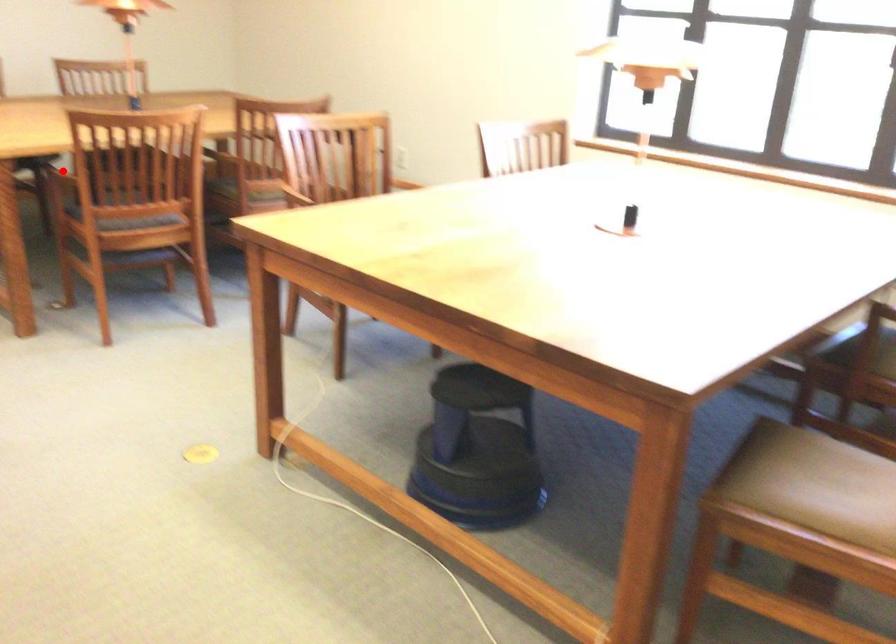
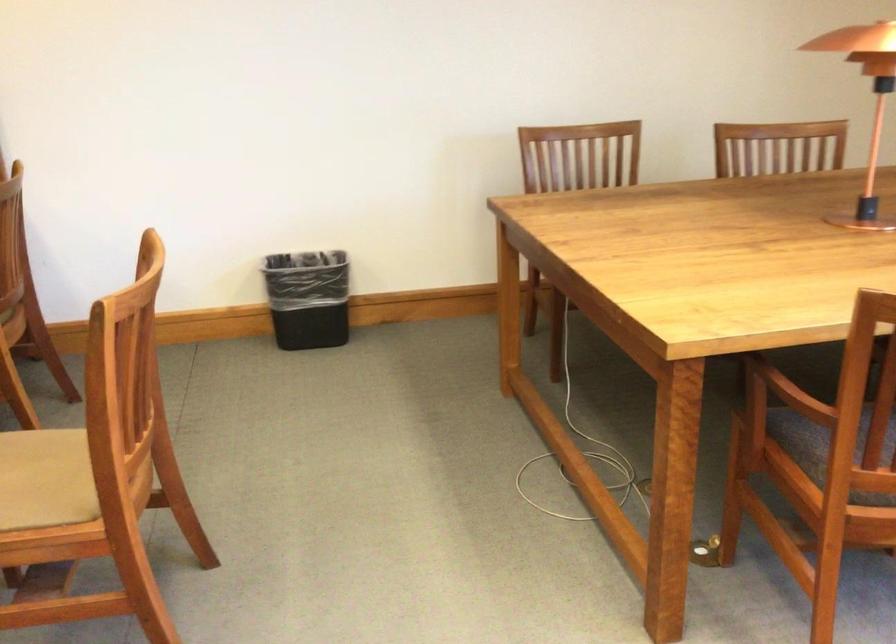
Question: I am providing you with two images of the same scene from different viewpoints. A red point is marked on the first image. Can you still see the location of the red point in image 2?

Choices:
 (A) Yes
 (B) No

Answer: (B)